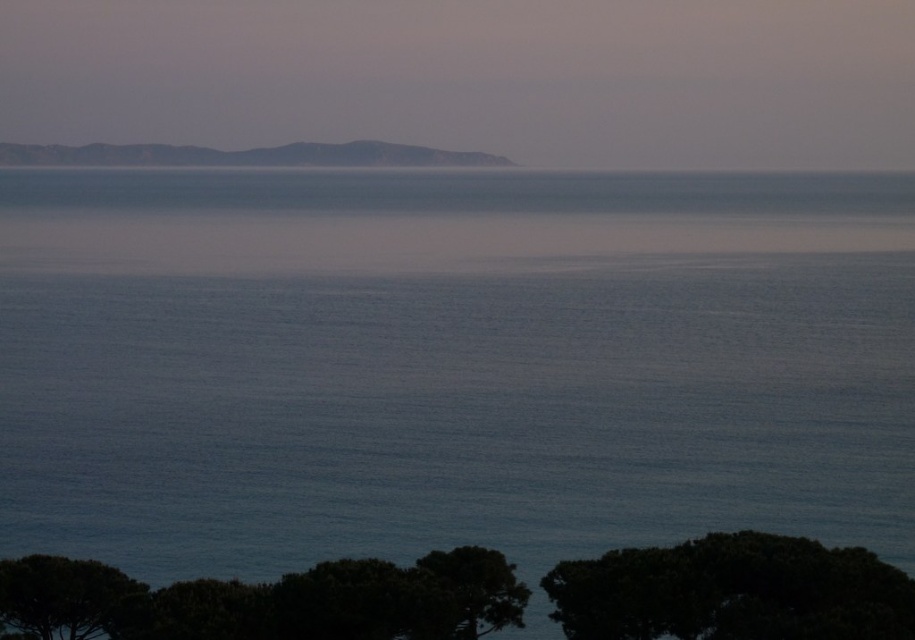
Question: Which of the following is the farthest from the observer?

Choices:
 (A) dark green leafy tree at lower left
 (B) green leafy tree at lower center
 (C) gray rocky island at upper left
 (D) dark green leafy tree at lower right

Answer: (C)

Question: Which object appears closest to the camera in this image?

Choices:
 (A) dark green leafy tree at lower left
 (B) gray rocky island at upper left

Answer: (A)

Question: Which point is closer to the camera?

Choices:
 (A) dark green leafy tree at lower left
 (B) green leafy tree at lower center

Answer: (B)

Question: Does blue smooth water at center appear over green leafy tree at lower center?

Choices:
 (A) yes
 (B) no

Answer: (A)

Question: Can you confirm if blue smooth water at center is smaller than green leafy tree at lower center?

Choices:
 (A) yes
 (B) no

Answer: (B)

Question: Is blue smooth water at center thinner than gray rocky island at upper left?

Choices:
 (A) yes
 (B) no

Answer: (B)